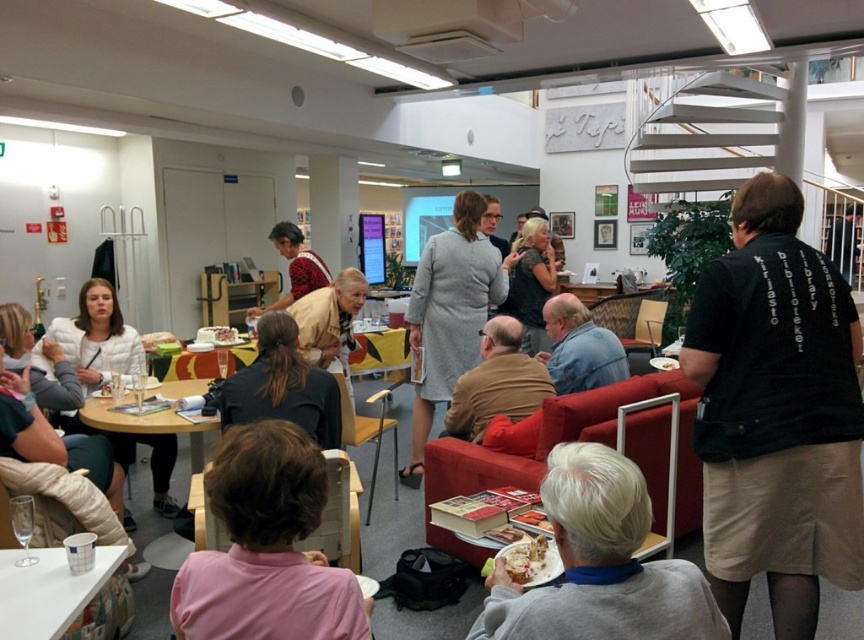
Question: Among these objects, which one is farthest from the camera?

Choices:
 (A) matte red dress at center
 (B) white cake at center

Answer: (B)

Question: Which of the following is the farthest from the observer?

Choices:
 (A) (87, 385)
 (B) (643, 516)
 (C) (462, 381)
 (D) (294, 296)

Answer: (D)

Question: Which point is closer to the camera?

Choices:
 (A) (261, 460)
 (B) (513, 304)
 (C) (756, 300)

Answer: (A)

Question: Where is pink fabric shirt at lower left located in relation to black dress at center in the image?

Choices:
 (A) below
 (B) above

Answer: (A)

Question: From the image, what is the correct spatial relationship of matte red dress at center in relation to white cake with frosting at center?

Choices:
 (A) right
 (B) left

Answer: (A)

Question: Can you confirm if black dress at center is positioned to the right of wooden table at center?

Choices:
 (A) yes
 (B) no

Answer: (A)